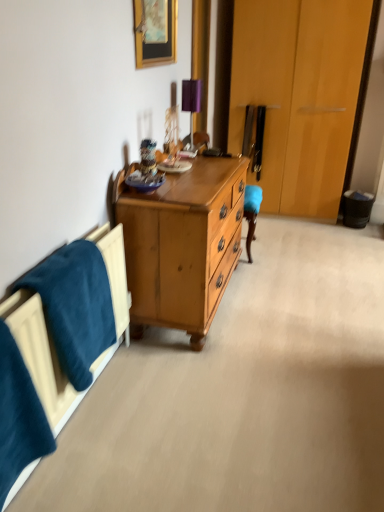
Question: From the image's perspective, is velvety blue blanket at lower left, which is the second blanket in front-to-back order, positioned above or below wooden picture frame at upper center?

Choices:
 (A) above
 (B) below

Answer: (B)

Question: From a real-world perspective, is velvety blue blanket at lower left, which is the second blanket in front-to-back order, above or below wooden picture frame at upper center?

Choices:
 (A) above
 (B) below

Answer: (B)

Question: Estimate the real-world distances between objects in this image. Which object is farther from the velvety blue blanket at lower left, which is the second blanket in front-to-back order?

Choices:
 (A) purple fabric table lamp at upper center
 (B) velvety blue blanket at lower left, which is the first blanket in front-to-back order
 (C) wooden picture frame at upper center

Answer: (A)

Question: Which object is positioned closest to the velvety blue blanket at lower left, which is the first blanket in front-to-back order?

Choices:
 (A) velvety blue blanket at lower left, which is the second blanket in front-to-back order
 (B) purple fabric table lamp at upper center
 (C) wooden picture frame at upper center

Answer: (A)